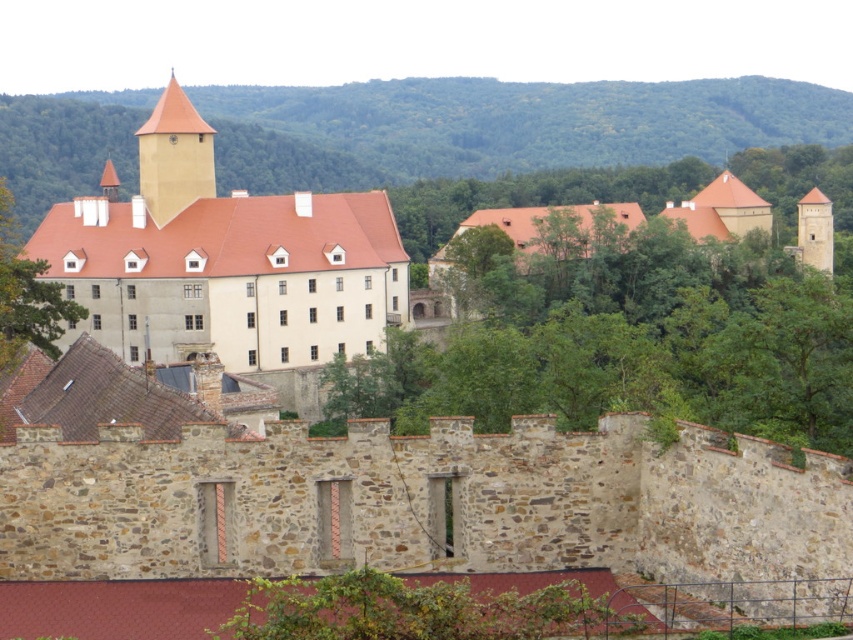
Question: From the image, what is the correct spatial relationship of matte yellow tower at upper left in relation to smooth beige tower at right?

Choices:
 (A) above
 (B) below

Answer: (A)

Question: Which of these objects is positioned closest to the smooth beige tower at right?

Choices:
 (A) matte beige stone building at center
 (B) green leafy hillside at upper center
 (C) matte yellow tower at upper left

Answer: (A)

Question: Which object is the farthest from the green leafy hillside at upper center?

Choices:
 (A) matte yellow tower at upper left
 (B) smooth beige tower at right

Answer: (A)

Question: Which point is closer to the camera?

Choices:
 (A) smooth beige tower at right
 (B) green leafy hillside at upper center
 (C) matte yellow tower at upper left
 (D) matte beige stone building at center

Answer: (D)

Question: Does matte beige stone building at center have a larger size compared to smooth beige tower at right?

Choices:
 (A) yes
 (B) no

Answer: (A)

Question: In this image, where is green leafy hillside at upper center located relative to matte beige stone building at center?

Choices:
 (A) below
 (B) above

Answer: (B)